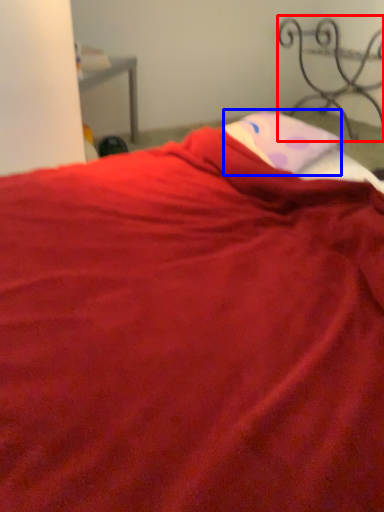
Question: Which object appears farthest to the camera in this image, furniture (highlighted by a red box) or pillow (highlighted by a blue box)?

Choices:
 (A) furniture
 (B) pillow

Answer: (A)